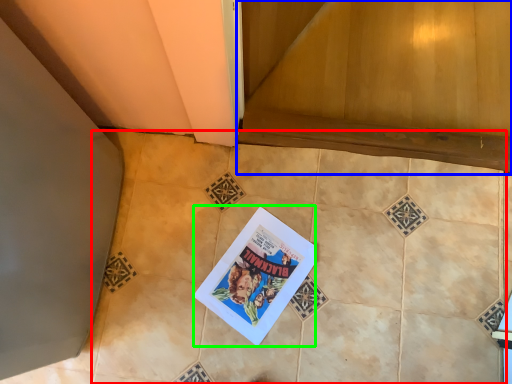
Question: Based on their relative distances, which object is farther from ceramic tile (highlighted by a red box)? Choose from stairwell (highlighted by a blue box) and comic book (highlighted by a green box).

Choices:
 (A) stairwell
 (B) comic book

Answer: (A)